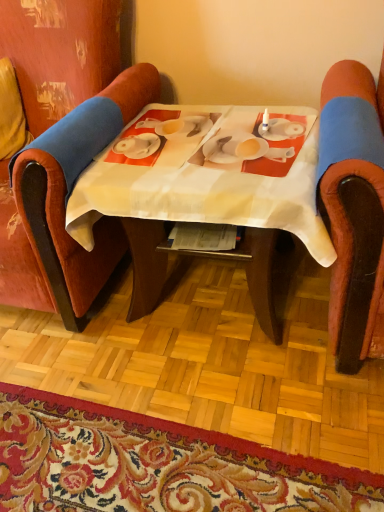
I want to click on free space above carpet with floral pattern at lower center (from a real-world perspective), so click(127, 460).